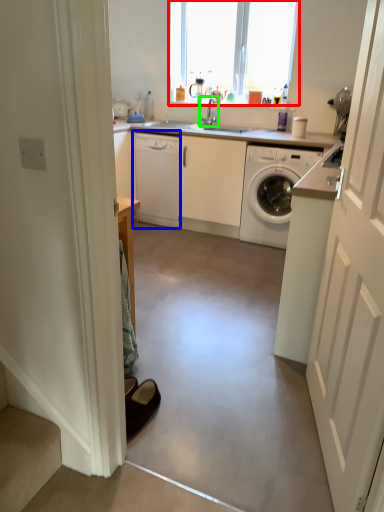
Question: Which object is the farthest from window (highlighted by a red box)? Choose among these: dish washer (highlighted by a blue box) or tap (highlighted by a green box).

Choices:
 (A) dish washer
 (B) tap

Answer: (A)